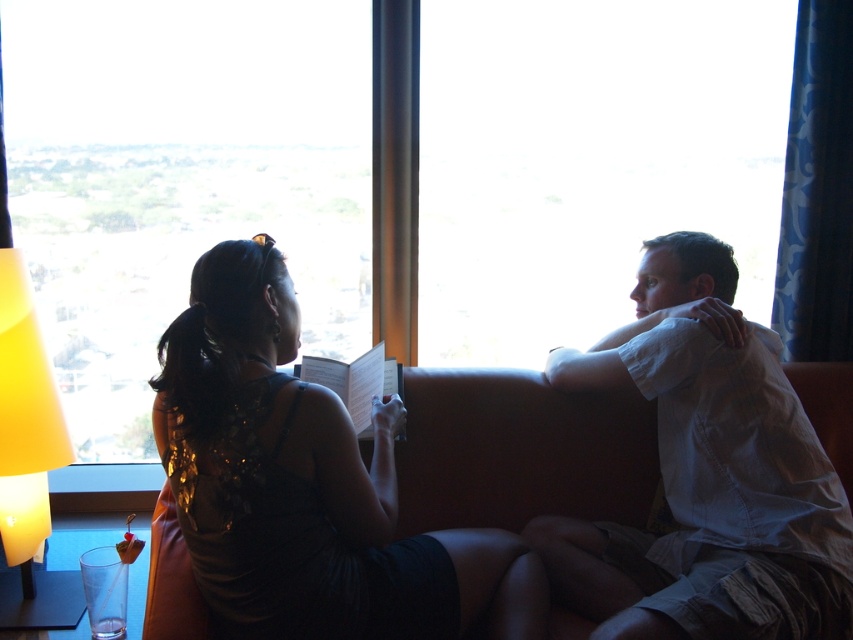
Who is higher up, black sequined dress at center or orange leather couch at center?

orange leather couch at center is higher up.

Identify the location of black sequined dress at center. The image size is (853, 640). (306, 484).

What are the coordinates of `black sequined dress at center` in the screenshot? It's located at (306, 484).

Who is more forward, (193, 124) or (54, 397)?

Point (54, 397) is more forward.

This screenshot has height=640, width=853. Describe the element at coordinates (178, 182) in the screenshot. I see `transparent glass window at upper center` at that location.

Locate an element on the screen. Image resolution: width=853 pixels, height=640 pixels. transparent glass window at upper center is located at coordinates (178, 182).

The width and height of the screenshot is (853, 640). Describe the element at coordinates (25, 422) in the screenshot. I see `translucent yellow lampshade at left` at that location.

Can you confirm if translucent yellow lampshade at left is taller than white paper book at center?

Indeed, translucent yellow lampshade at left has a greater height compared to white paper book at center.

Locate an element on the screen. This screenshot has width=853, height=640. translucent yellow lampshade at left is located at coordinates (25, 422).